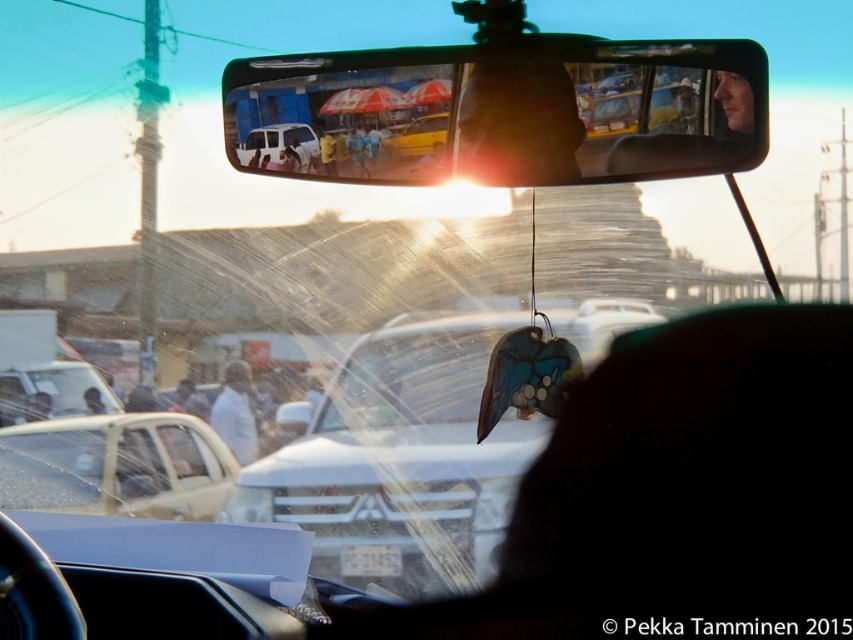
You are sitting in the car and looking at the windshield. You see the white matte car at left and the light brown leather jacket at center. Which object is closer to the bottom of the windshield?

The white matte car at left is closer to the bottom of the windshield because it is positioned below the light brown leather jacket at center.

Looking at this image, you are inside a car and looking through the windshield. There is a point at coordinate (x=401, y=456). Based on the scene description, where is this point located?

The point at coordinate (x=401, y=456) is on the white glossy car at center.

You are inside a car and looking through the windshield. There is a point marked at coordinates (115, 465). What object is located at this point?

The point at coordinates (115, 465) marks the white matte car at left.